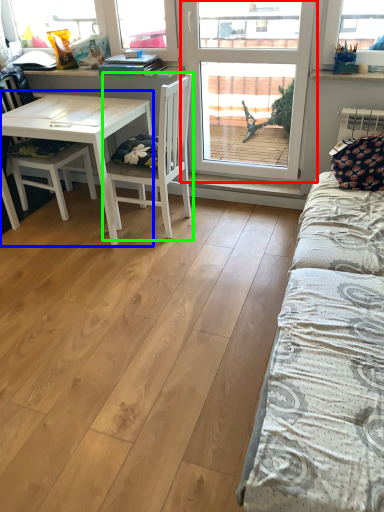
Question: Considering the real-world distances, which object is farthest from window (highlighted by a red box)? table (highlighted by a blue box) or chair (highlighted by a green box)?

Choices:
 (A) table
 (B) chair

Answer: (A)